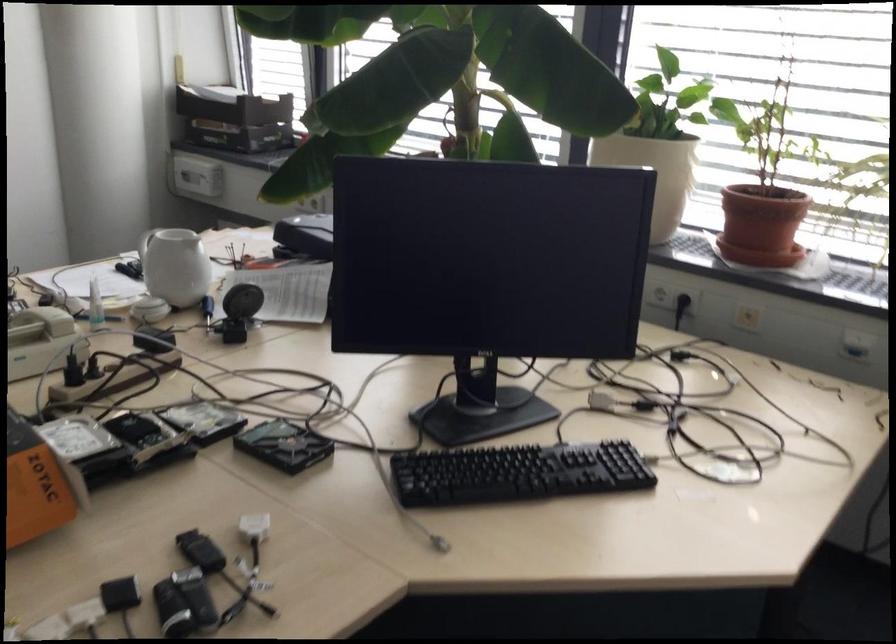
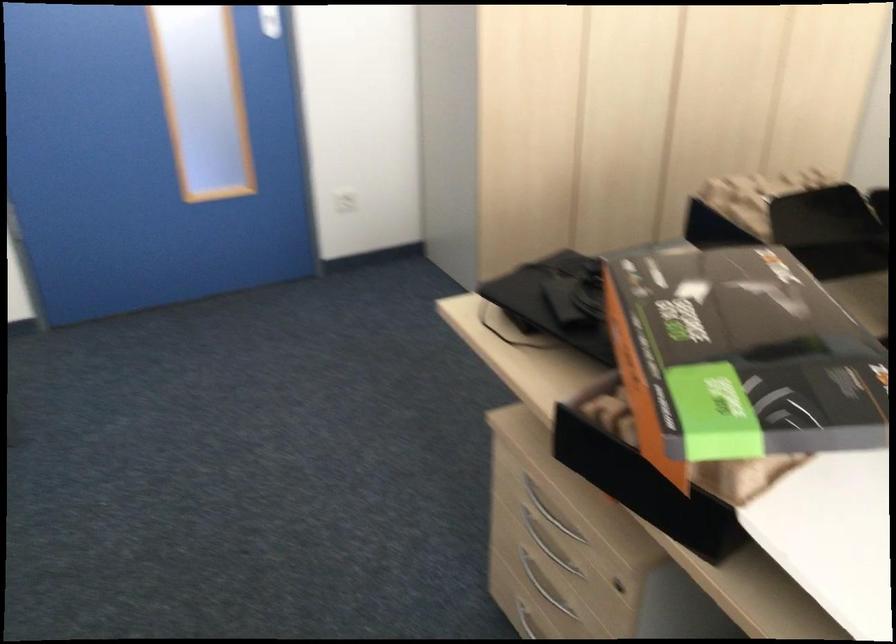
Based on the continuous images, in which direction is the camera rotating?

The camera rotated toward left-down.